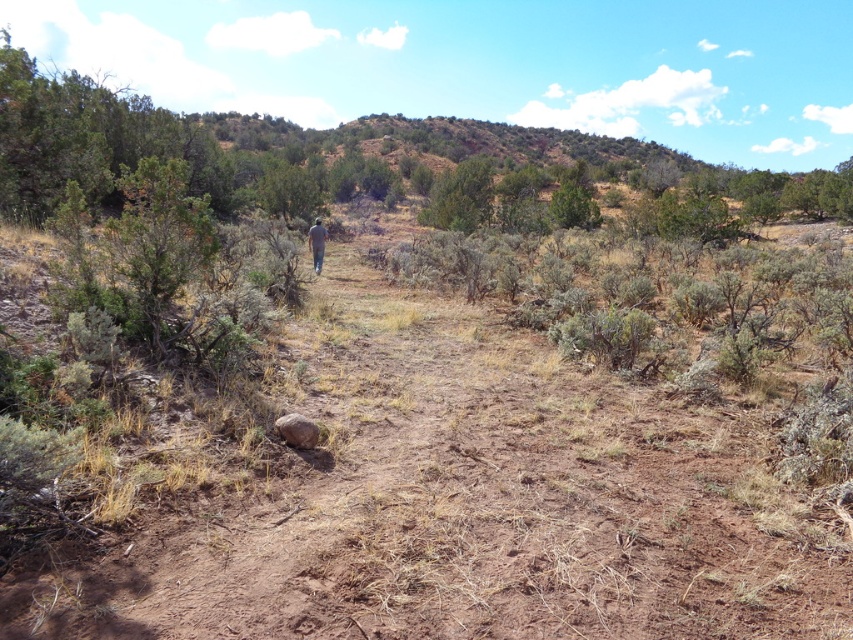
Find the location of a particular element. Image resolution: width=853 pixels, height=640 pixels. brown dirt track at center is located at coordinates click(x=456, y=467).